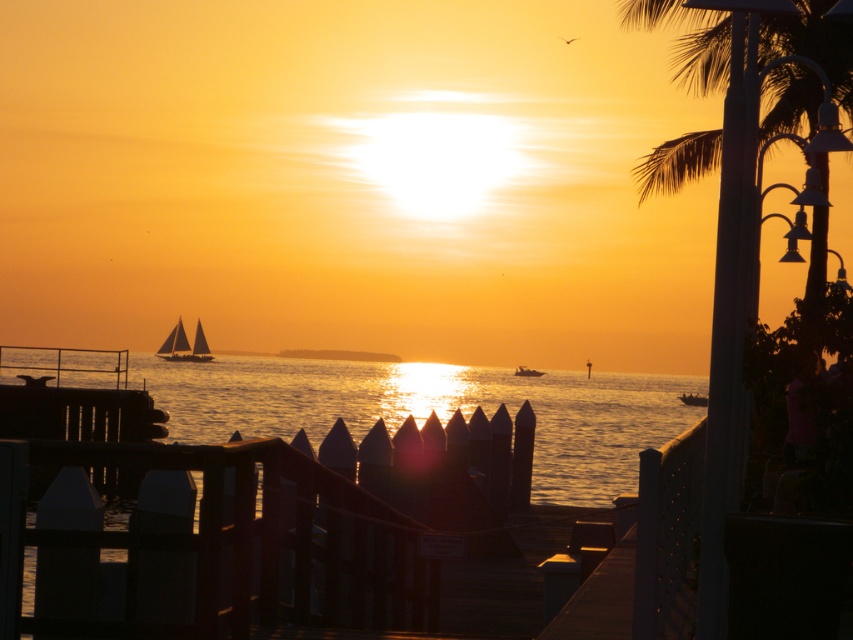
Is glistening water at center wider than smooth wooden boat at center?

Yes.

Does glistening water at center have a larger size compared to smooth wooden boat at center?

Yes.

Between point (305, 406) and point (701, 401), which one is positioned behind?

Point (701, 401)

Find the location of a particular element. The height and width of the screenshot is (640, 853). glistening water at center is located at coordinates (431, 408).

Which of these two, matte black sailboat at left or metallic silver boat at center, stands taller?

matte black sailboat at left

Measure the distance between matte black sailboat at left and camera.

matte black sailboat at left and camera are 310.96 feet apart from each other.

Is point (177, 336) positioned in front of point (532, 371)?

Yes, it is.

This screenshot has width=853, height=640. Find the location of `matte black sailboat at left`. matte black sailboat at left is located at coordinates (184, 346).

Who is positioned more to the left, green leafy palm tree at upper right or metallic silver boat at center?

From the viewer's perspective, metallic silver boat at center appears more on the left side.

Describe the element at coordinates (688, 38) in the screenshot. I see `green leafy palm tree at upper right` at that location.

The width and height of the screenshot is (853, 640). I want to click on green leafy palm tree at upper right, so click(x=688, y=38).